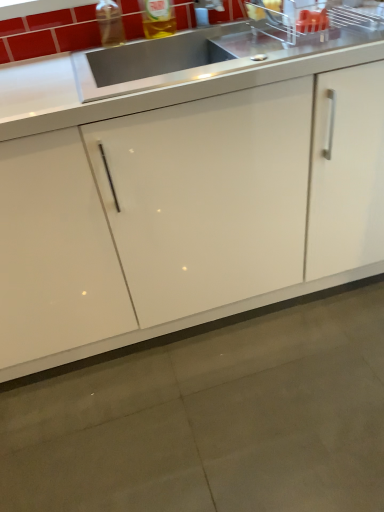
Question: Considering the positions of satin steel sink at upper center and white glossy cabinet at center in the image, is satin steel sink at upper center bigger or smaller than white glossy cabinet at center?

Choices:
 (A) small
 (B) big

Answer: (A)

Question: Would you say satin steel sink at upper center is inside or outside white glossy cabinet at center?

Choices:
 (A) outside
 (B) inside

Answer: (B)

Question: Estimate the real-world distances between objects in this image. Which object is closer to the transparent plastic bottle at upper left?

Choices:
 (A) satin steel sink at upper center
 (B) translucent plastic bottle at upper center
 (C) white glossy cabinet at center

Answer: (B)

Question: Estimate the real-world distances between objects in this image. Which object is closer to the translucent plastic bottle at upper center?

Choices:
 (A) white glossy cabinet at center
 (B) satin steel sink at upper center
 (C) transparent plastic bottle at upper left

Answer: (C)